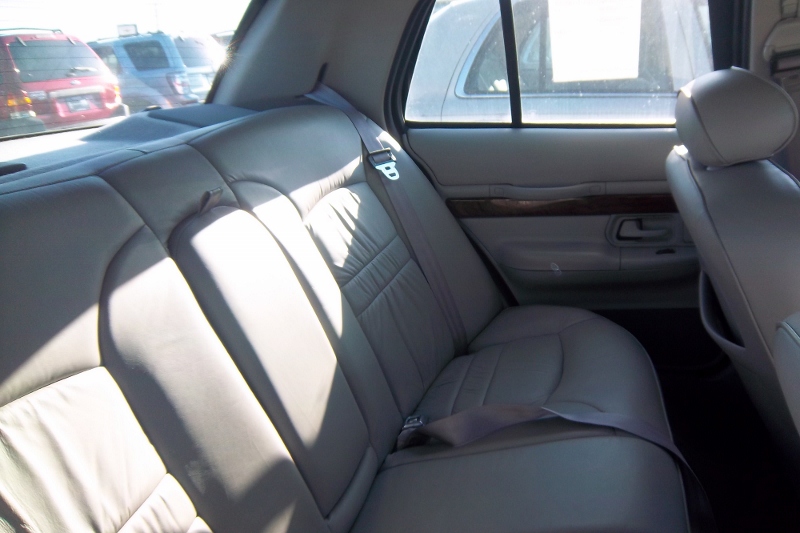
The height and width of the screenshot is (533, 800). What are the coordinates of `window` in the screenshot? It's located at (78, 78), (585, 51), (460, 61).